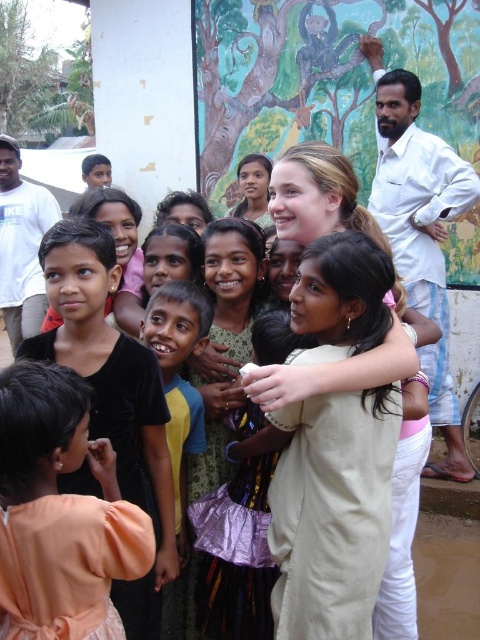
Question: Observing the image, what is the correct spatial positioning of beige cotton dress at center in reference to white cotton shirt at right?

Choices:
 (A) left
 (B) right

Answer: (A)

Question: Is painted mural at upper center bigger than beige cotton dress at center?

Choices:
 (A) no
 (B) yes

Answer: (A)

Question: Which point is closer to the camera?

Choices:
 (A) (261, 122)
 (B) (393, 106)
 (C) (136, 573)
 (D) (340, 496)

Answer: (C)

Question: Among these objects, which one is farthest from the camera?

Choices:
 (A) white cotton shirt at right
 (B) painted mural at upper center

Answer: (B)

Question: Which of the following is the closest to the observer?

Choices:
 (A) white cotton shirt at right
 (B) light peach fabric dress at lower left
 (C) beige cotton dress at center
 (D) painted mural at upper center

Answer: (B)

Question: Is painted mural at upper center to the right of white cotton shirt at right from the viewer's perspective?

Choices:
 (A) yes
 (B) no

Answer: (B)